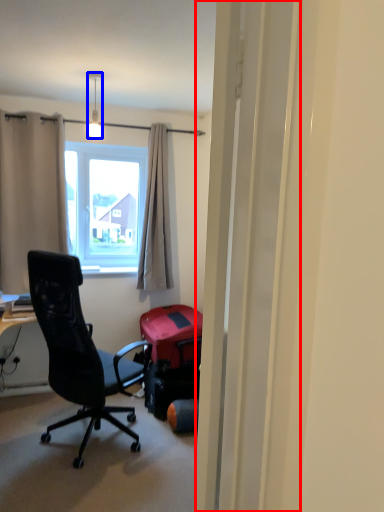
Question: Which point is closer to the camera, screen door (highlighted by a red box) or lamp (highlighted by a blue box)?

Choices:
 (A) screen door
 (B) lamp

Answer: (A)